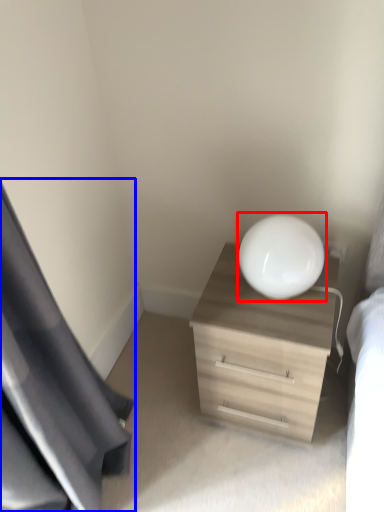
Question: Which point is further to the camera, round table (highlighted by a red box) or curtain (highlighted by a blue box)?

Choices:
 (A) round table
 (B) curtain

Answer: (A)